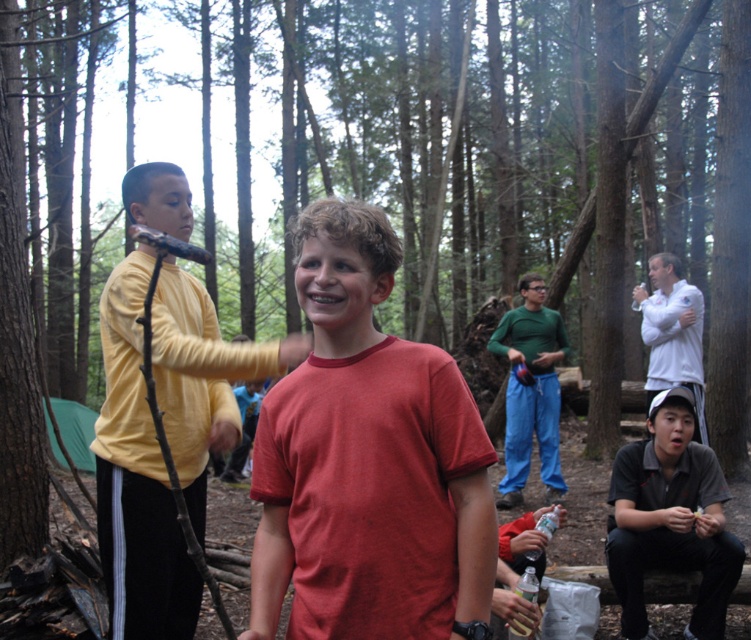
Question: Is yellow fleece jacket at left above green fabric pants at center?

Choices:
 (A) no
 (B) yes

Answer: (B)

Question: Observing the image, what is the correct spatial positioning of matte red t-shirt at center in reference to dark gray polo shirt at lower right?

Choices:
 (A) right
 (B) left

Answer: (B)

Question: Which point appears closest to the camera in this image?

Choices:
 (A) (511, 420)
 (B) (650, 372)
 (C) (691, 563)

Answer: (C)

Question: Which object is positioned closest to the green fabric pants at center?

Choices:
 (A) white matte shirt at right
 (B) matte red t-shirt at center

Answer: (A)

Question: Which object is farther from the camera taking this photo?

Choices:
 (A) yellow fleece jacket at left
 (B) white matte shirt at right
 (C) green fabric pants at center
 (D) dark gray polo shirt at lower right

Answer: (C)

Question: Is dark gray polo shirt at lower right bigger than green fabric pants at center?

Choices:
 (A) yes
 (B) no

Answer: (B)